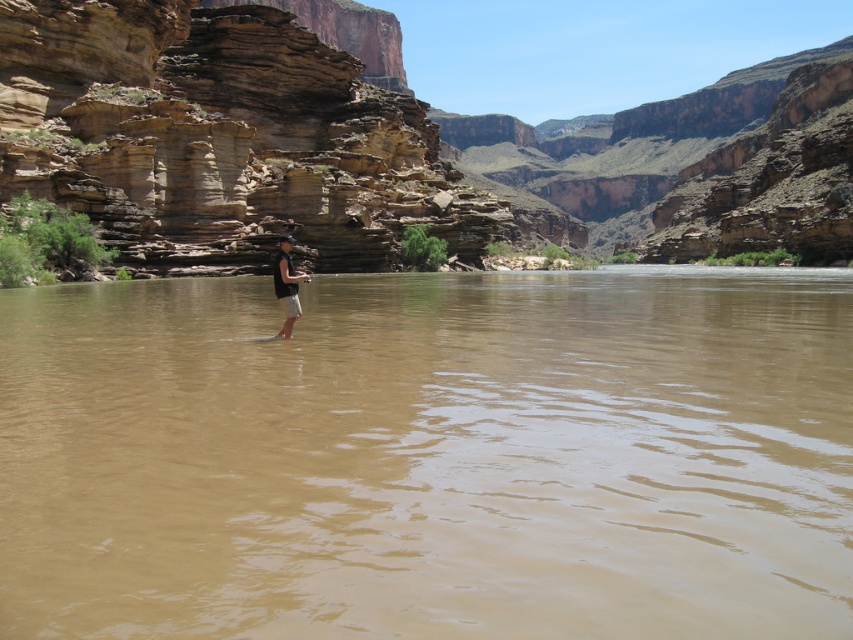
You are a hiker standing at the point labeled as point (430, 456) in the image. What is the terrain like at your current location?

The terrain at point (430, 456) is brown muddy water at center, indicating that you are standing in the river.